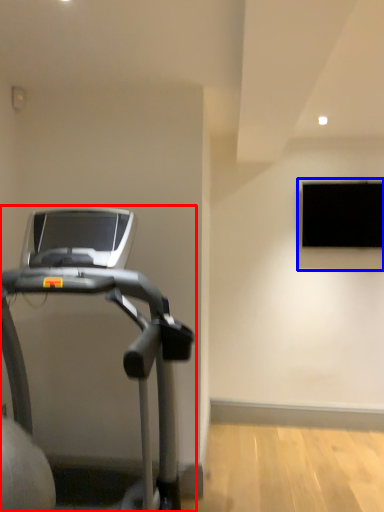
Question: Among these objects, which one is farthest to the camera, treadmill (highlighted by a red box) or window (highlighted by a blue box)?

Choices:
 (A) treadmill
 (B) window

Answer: (B)